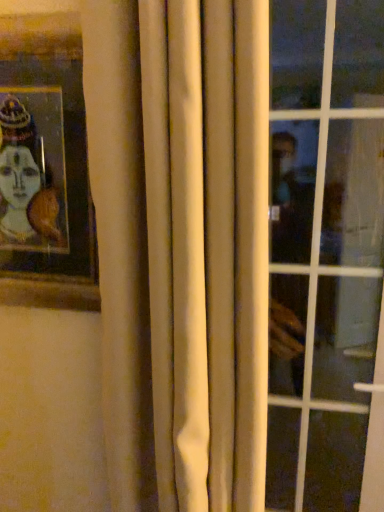
Question: From a real-world perspective, is white fabric curtain at center above or below wooden picture frame at upper left?

Choices:
 (A) below
 (B) above

Answer: (A)

Question: Visually, is white fabric curtain at center positioned to the left or to the right of wooden picture frame at upper left?

Choices:
 (A) left
 (B) right

Answer: (B)

Question: Considering the real-world distances, which object is farthest from the white fabric curtain at center?

Choices:
 (A) transparent glass window at right
 (B) wooden picture frame at upper left

Answer: (A)

Question: Based on their relative distances, which object is nearer to the transparent glass window at right?

Choices:
 (A) white fabric curtain at center
 (B) wooden picture frame at upper left

Answer: (A)